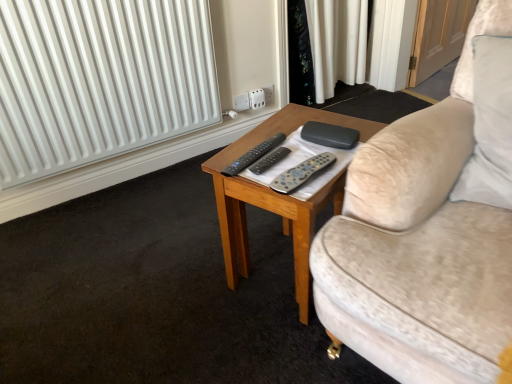
The height and width of the screenshot is (384, 512). Find the location of `unoccupied space behind black matte case at center`. unoccupied space behind black matte case at center is located at coordinates (305, 120).